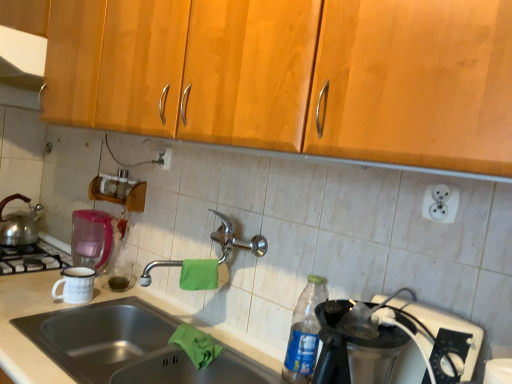
This screenshot has width=512, height=384. Find the location of `free spot above pink plastic coffee machine at left (from a real-world perspective)`. free spot above pink plastic coffee machine at left (from a real-world perspective) is located at coordinates (93, 212).